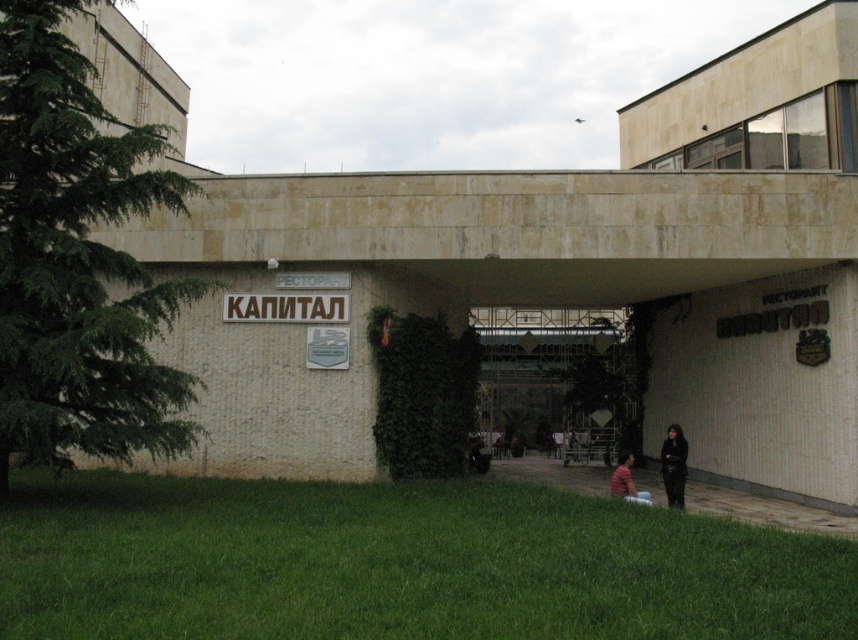
Is transparent glass entrance at center bigger than dark gray jacket at lower right?

Actually, transparent glass entrance at center might be smaller than dark gray jacket at lower right.

Is transparent glass entrance at center positioned behind dark gray jacket at lower right?

Yes, it is.

This screenshot has width=858, height=640. What are the coordinates of `transparent glass entrance at center` in the screenshot? It's located at (559, 378).

Where is `transparent glass entrance at center`? The height and width of the screenshot is (640, 858). transparent glass entrance at center is located at coordinates (559, 378).

Does transparent glass entrance at center have a larger size compared to striped cotton shirt at lower center?

No.

Consider the image. Is transparent glass entrance at center to the left of striped cotton shirt at lower center from the viewer's perspective?

In fact, transparent glass entrance at center is to the right of striped cotton shirt at lower center.

Which is in front, point (554, 420) or point (623, 490)?

Point (623, 490)

Find the location of a particular element. The height and width of the screenshot is (640, 858). transparent glass entrance at center is located at coordinates (559, 378).

Between dark gray jacket at lower right and striped cotton shirt at lower center, which one appears on the left side from the viewer's perspective?

striped cotton shirt at lower center

Is dark gray jacket at lower right closer to camera compared to striped cotton shirt at lower center?

Yes, dark gray jacket at lower right is closer to the viewer.

You are a GUI agent. You are given a task and a screenshot of the screen. Output one action in this format:
    pyautogui.click(x=<x>, y=<y>)
    Task: Click on the dark gray jacket at lower right
    The height and width of the screenshot is (640, 858).
    Given the screenshot: What is the action you would take?
    pyautogui.click(x=674, y=465)